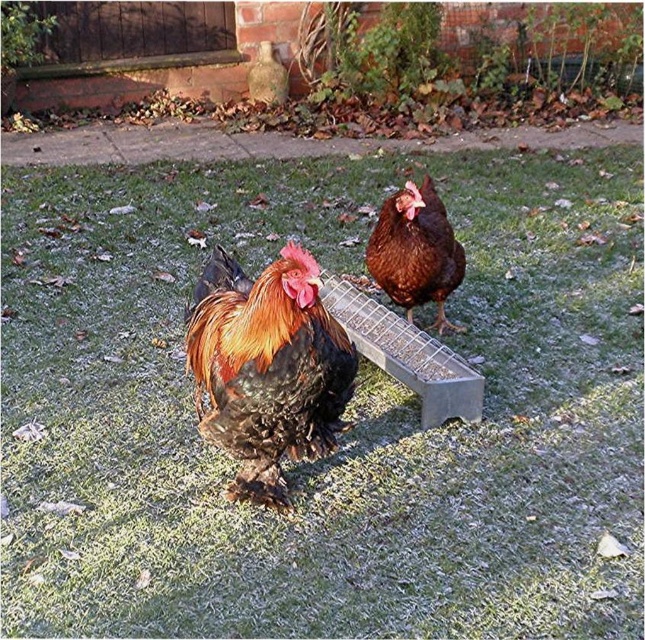
Question: Where is shiny brown rooster at center located in relation to brown matte chicken at center in the image?

Choices:
 (A) above
 (B) below

Answer: (B)

Question: Which point is farther to the camera?

Choices:
 (A) shiny brown rooster at center
 (B) brown matte chicken at center

Answer: (B)

Question: Is shiny brown rooster at center in front of brown matte chicken at center?

Choices:
 (A) no
 (B) yes

Answer: (B)

Question: Which point is closer to the camera taking this photo?

Choices:
 (A) (277, 474)
 (B) (408, 189)

Answer: (A)

Question: Is shiny brown rooster at center to the right of brown matte chicken at center from the viewer's perspective?

Choices:
 (A) yes
 (B) no

Answer: (B)